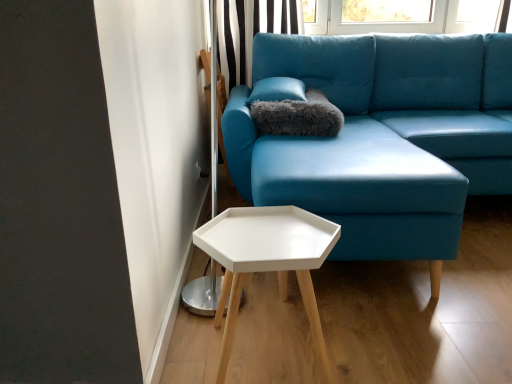
Question: Can you confirm if matte blue fabric couch at center is bigger than white matte hexagonal table at lower center?

Choices:
 (A) yes
 (B) no

Answer: (A)

Question: Is matte blue fabric couch at center closer to camera compared to white matte hexagonal table at lower center?

Choices:
 (A) yes
 (B) no

Answer: (B)

Question: Considering the relative sizes of matte blue fabric couch at center and white matte hexagonal table at lower center in the image provided, is matte blue fabric couch at center wider than white matte hexagonal table at lower center?

Choices:
 (A) no
 (B) yes

Answer: (B)

Question: From the image's perspective, is matte blue fabric couch at center on top of white matte hexagonal table at lower center?

Choices:
 (A) yes
 (B) no

Answer: (A)

Question: Considering the relative sizes of matte blue fabric couch at center and white matte hexagonal table at lower center in the image provided, is matte blue fabric couch at center thinner than white matte hexagonal table at lower center?

Choices:
 (A) no
 (B) yes

Answer: (A)

Question: Can you confirm if matte blue fabric couch at center is positioned to the left of white matte hexagonal table at lower center?

Choices:
 (A) yes
 (B) no

Answer: (B)

Question: Considering the relative sizes of white matte hexagonal table at lower center and matte blue fabric couch at center in the image provided, is white matte hexagonal table at lower center thinner than matte blue fabric couch at center?

Choices:
 (A) no
 (B) yes

Answer: (B)

Question: Would you say white matte hexagonal table at lower center is outside matte blue fabric couch at center?

Choices:
 (A) yes
 (B) no

Answer: (A)

Question: Does white matte hexagonal table at lower center have a greater width compared to matte blue fabric couch at center?

Choices:
 (A) yes
 (B) no

Answer: (B)

Question: Can you confirm if white matte hexagonal table at lower center is smaller than matte blue fabric couch at center?

Choices:
 (A) no
 (B) yes

Answer: (B)

Question: Is white matte hexagonal table at lower center not close to matte blue fabric couch at center?

Choices:
 (A) no
 (B) yes

Answer: (A)

Question: From a real-world perspective, is white matte hexagonal table at lower center positioned over matte blue fabric couch at center based on gravity?

Choices:
 (A) no
 (B) yes

Answer: (A)

Question: Is gray fluffy pillow at upper center far from white matte hexagonal table at lower center?

Choices:
 (A) yes
 (B) no

Answer: (B)